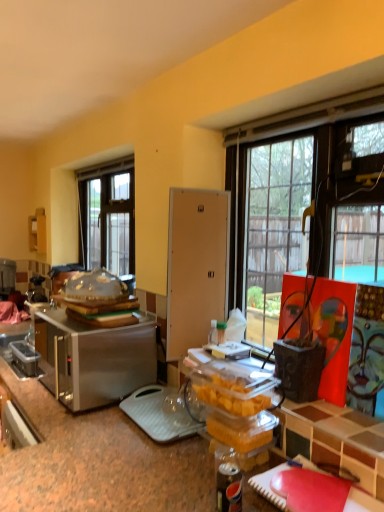
Question: Do you think satin silver toaster at left, marked as the first appliance in a front-to-back arrangement, is within brushed metal toaster at left, the 2th appliance positioned from the front, or outside of it?

Choices:
 (A) inside
 (B) outside

Answer: (B)

Question: In terms of width, does satin silver toaster at left, marked as the first appliance in a front-to-back arrangement, look wider or thinner when compared to brushed metal toaster at left, which appears as the second appliance when viewed from the right?

Choices:
 (A) thin
 (B) wide

Answer: (B)

Question: Considering the real-world distances, which object is closest to the clear plastic dome at center?

Choices:
 (A) brushed metal toaster at left, which appears as the second appliance when viewed from the right
 (B) satin silver toaster at left, which is counted as the 1th appliance, starting from the right
 (C) clear glass window at upper left
 (D) matte white cabinet at left

Answer: (B)

Question: Estimate the real-world distances between objects in this image. Which object is closer to the brushed metal toaster at left, the 2th appliance positioned from the front?

Choices:
 (A) matte white cabinet at left
 (B) clear glass window at upper left
 (C) satin silver toaster at left, which is counted as the 1th appliance, starting from the right
 (D) clear plastic dome at center

Answer: (A)